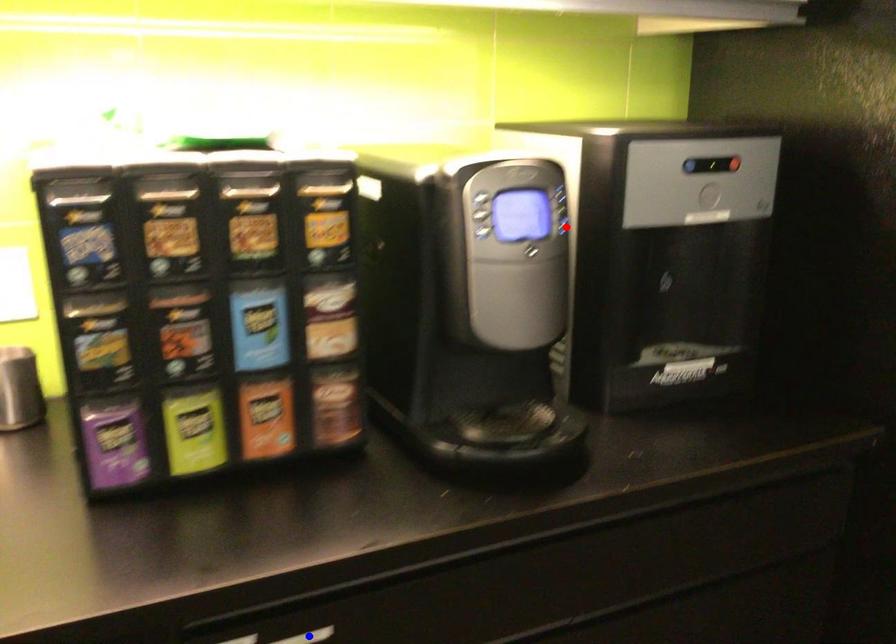
Question: In the image, two points are highlighted. Which point is nearer to the camera? Reply with the corresponding letter.

Choices:
 (A) blue point
 (B) red point

Answer: (A)